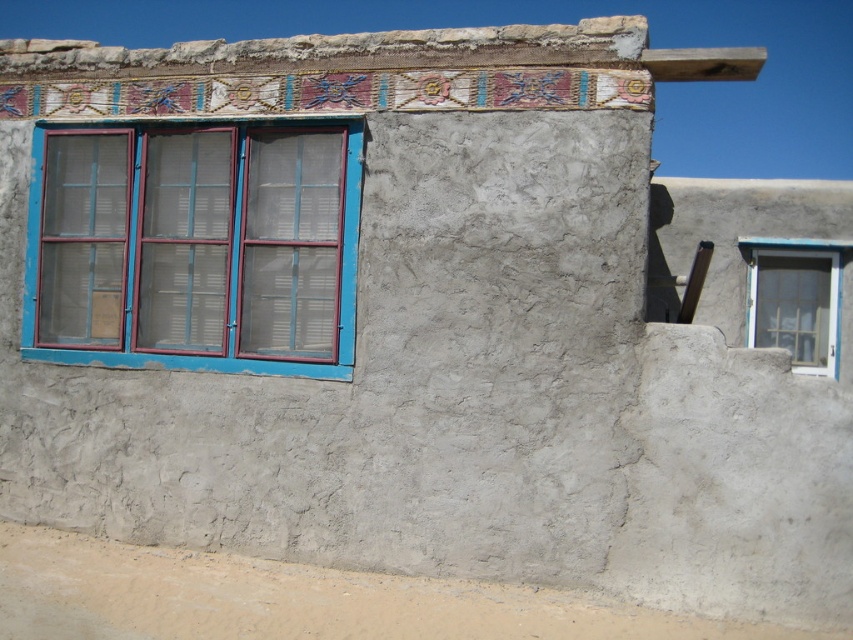
You are standing in front of a rustic adobe building. You see a point marked at coordinates (194, 248). Which object does this point correspond to?

The point at (194, 248) corresponds to the blue painted wood window at left.

You are standing in front of a rustic adobe building and want to know how far a specific point on the wall is from you. The point you are interested in is labeled as point (77, 163). Can you determine the distance of this point from your current position?

The distance of point (77, 163) from the viewer is 7.64 meters.

You are standing in front of a rustic adobe building and notice two windows. The blue painted wood window at left and the white painted wood window at right. Which window is positioned closer to you?

The blue painted wood window at left is closer to the viewer than the white painted wood window at right.